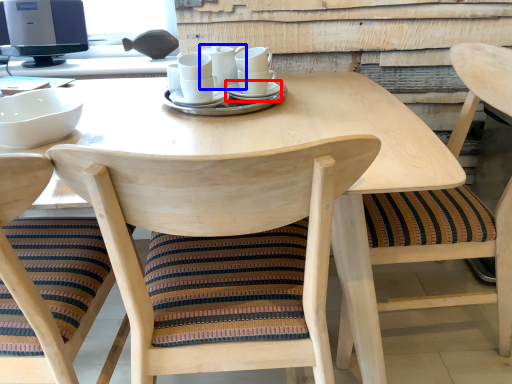
Question: Which object is further to the camera taking this photo, saucer (highlighted by a red box) or tableware (highlighted by a blue box)?

Choices:
 (A) saucer
 (B) tableware

Answer: (B)